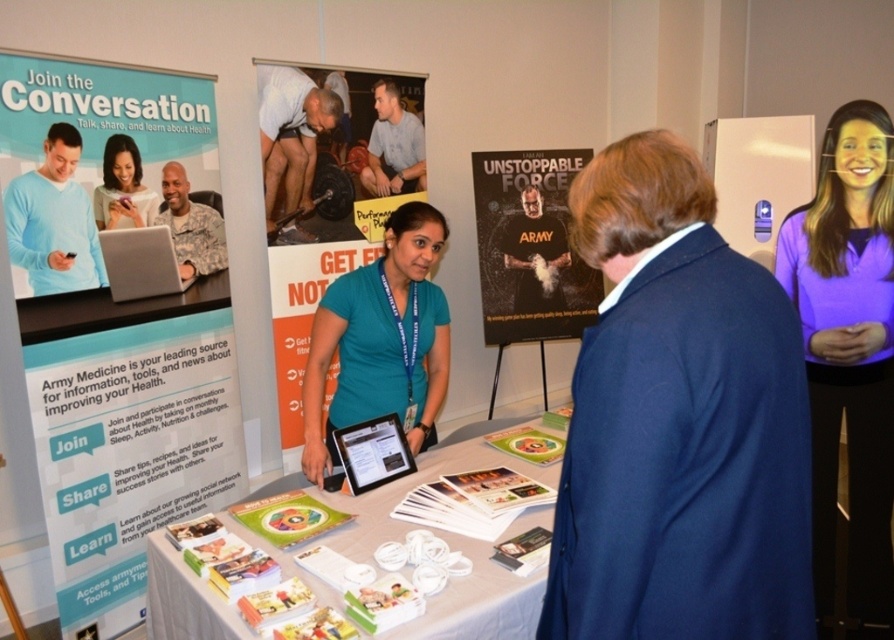
Is teal fabric shirt at center closer to the viewer compared to camouflage uniform at center?

That is True.

Locate an element on the screen. Image resolution: width=894 pixels, height=640 pixels. teal fabric shirt at center is located at coordinates (381, 340).

Between point (326, 349) and point (166, 216), which one is positioned in front?

Point (326, 349)

Find the location of `teal fabric shirt at center`. teal fabric shirt at center is located at coordinates (381, 340).

Can you confirm if white paper at center is shorter than metallic silver poster at center?

Incorrect, white paper at center's height does not fall short of metallic silver poster at center's.

Can you confirm if white paper at center is bigger than metallic silver poster at center?

Yes.

Image resolution: width=894 pixels, height=640 pixels. Describe the element at coordinates (131, 449) in the screenshot. I see `white paper at center` at that location.

Locate an element on the screen. This screenshot has height=640, width=894. white paper at center is located at coordinates (131, 449).

Consider the image. Can you confirm if matte paper poster at upper left is taller than matte black phone at upper left?

Yes, matte paper poster at upper left is taller than matte black phone at upper left.

Which is behind, point (104, 108) or point (95, 198)?

Point (104, 108)

You are a GUI agent. You are given a task and a screenshot of the screen. Output one action in this format:
    pyautogui.click(x=<x>, y=<y>)
    Task: Click on the matte paper poster at upper left
    Image resolution: width=894 pixels, height=640 pixels.
    Given the screenshot: What is the action you would take?
    pyautogui.click(x=91, y=157)